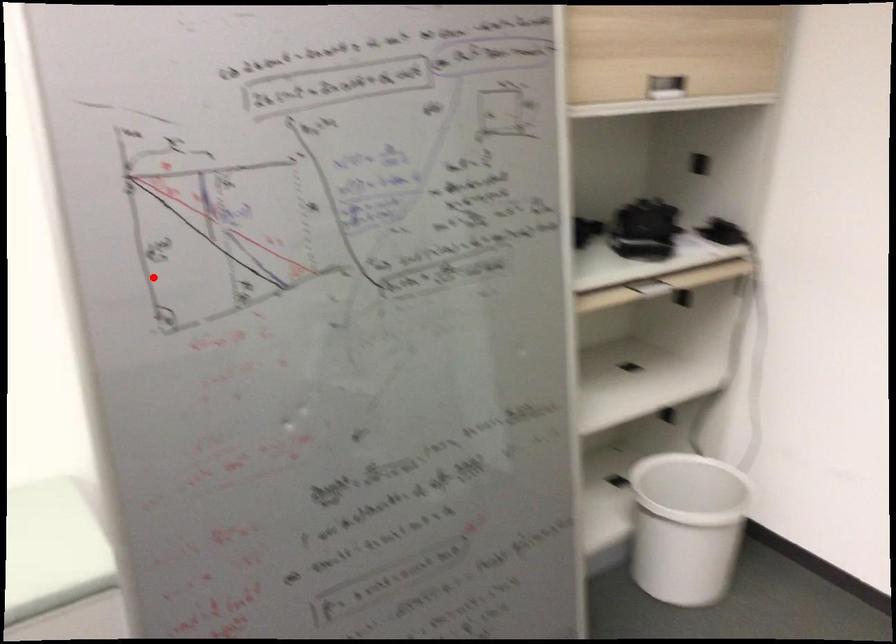
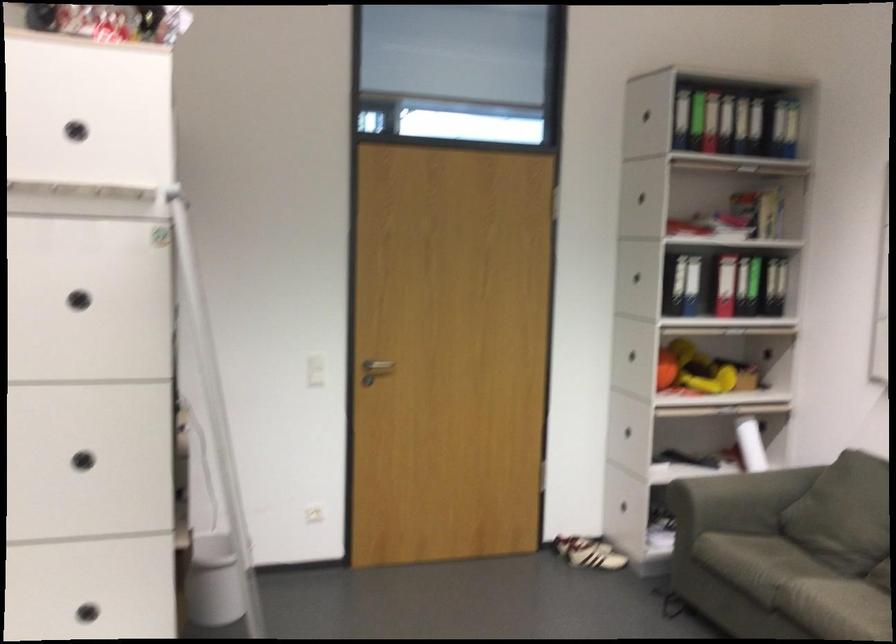
Question: I am providing you with two images of the same scene from different viewpoints. A red point is shown in image1. For the corresponding object point in image2, is it positioned nearer or farther from the camera?

Choices:
 (A) Nearer
 (B) Farther

Answer: (B)